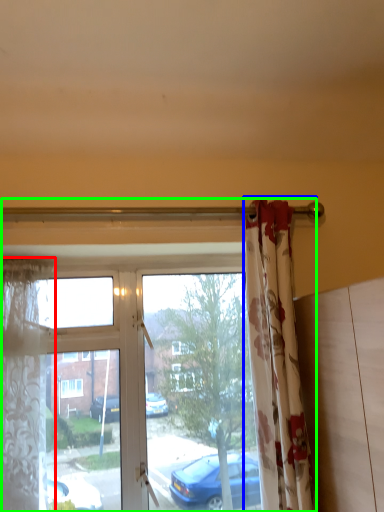
Question: Based on their relative distances, which object is farther from curtain (highlighted by a red box)? Choose from curtain (highlighted by a blue box) and window (highlighted by a green box).

Choices:
 (A) curtain
 (B) window

Answer: (A)